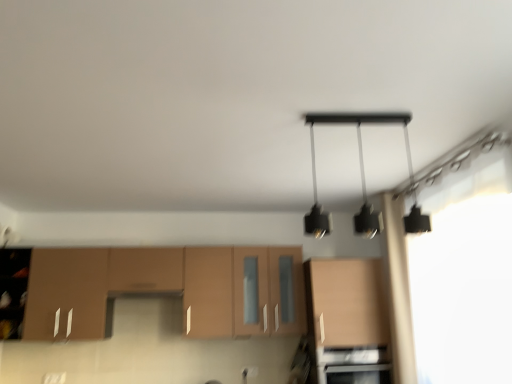
Question: Is matte wood cabinet at center, the 1th cabinetry when ordered from right to left, wider than black matte pendant light at upper center?

Choices:
 (A) yes
 (B) no

Answer: (A)

Question: Is matte wood cabinet at center, the 1th cabinetry when ordered from right to left, far from black matte pendant light at upper center?

Choices:
 (A) yes
 (B) no

Answer: (A)

Question: Does matte wood cabinet at center, the 1th cabinetry when ordered from right to left, contain black matte pendant light at upper center?

Choices:
 (A) yes
 (B) no

Answer: (B)

Question: From the image's perspective, would you say matte wood cabinet at center, the 2th cabinetry from the left, is shown under black matte pendant light at upper center?

Choices:
 (A) no
 (B) yes

Answer: (B)

Question: Considering the relative sizes of matte wood cabinet at center, the 2th cabinetry from the left, and black matte pendant light at upper center in the image provided, is matte wood cabinet at center, the 2th cabinetry from the left, smaller than black matte pendant light at upper center?

Choices:
 (A) yes
 (B) no

Answer: (B)

Question: Is matte wood cabinet at center, the 1th cabinetry when ordered from right to left, thinner than black matte pendant light at upper center?

Choices:
 (A) yes
 (B) no

Answer: (B)

Question: Is the position of black matte pendant light at upper center less distant than that of matte wood cabinet at center, the 2th cabinetry from the left?

Choices:
 (A) yes
 (B) no

Answer: (A)

Question: Would you say black matte pendant light at upper center contains matte wood cabinet at center, the 2th cabinetry from the left?

Choices:
 (A) yes
 (B) no

Answer: (B)

Question: Is black matte pendant light at upper center taller than matte wood cabinet at center, the 1th cabinetry when ordered from right to left?

Choices:
 (A) yes
 (B) no

Answer: (B)

Question: Can you confirm if black matte pendant light at upper center is shorter than matte wood cabinet at center, the 1th cabinetry when ordered from right to left?

Choices:
 (A) no
 (B) yes

Answer: (B)

Question: Can you confirm if black matte pendant light at upper center is bigger than matte wood cabinet at center, the 1th cabinetry when ordered from right to left?

Choices:
 (A) no
 (B) yes

Answer: (A)

Question: From the image's perspective, is black matte pendant light at upper center beneath matte wood cabinet at center, the 1th cabinetry when ordered from right to left?

Choices:
 (A) no
 (B) yes

Answer: (A)

Question: Is black stainless steel oven at lower center further to the viewer compared to matte wood cabinetry at lower left, the 1th cabinetry when ordered from left to right?

Choices:
 (A) yes
 (B) no

Answer: (B)